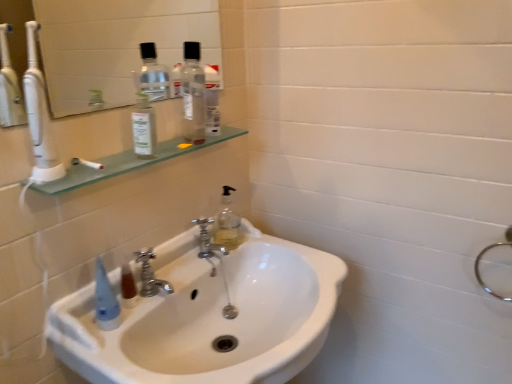
Question: From a real-world perspective, is silver metallic faucet at center, placed as the 2th tap when sorted from right to left, over white glossy sink at center?

Choices:
 (A) no
 (B) yes

Answer: (B)

Question: Can you confirm if silver metallic faucet at center, the 1th tap viewed from the front, is wider than white glossy sink at center?

Choices:
 (A) yes
 (B) no

Answer: (B)

Question: Considering the relative sizes of silver metallic faucet at center, the 1th tap viewed from the front, and white glossy sink at center in the image provided, is silver metallic faucet at center, the 1th tap viewed from the front, bigger than white glossy sink at center?

Choices:
 (A) no
 (B) yes

Answer: (A)

Question: From a real-world perspective, is silver metallic faucet at center, placed as the 2th tap when sorted from right to left, physically below white glossy sink at center?

Choices:
 (A) yes
 (B) no

Answer: (B)

Question: Can you confirm if silver metallic faucet at center, arranged as the second tap when viewed from the back, is shorter than white glossy sink at center?

Choices:
 (A) no
 (B) yes

Answer: (B)

Question: Is point (203, 137) positioned closer to the camera than point (204, 238)?

Choices:
 (A) farther
 (B) closer

Answer: (B)

Question: Is transparent plastic bottle at upper center, the second bottle viewed from the front, taller or shorter than silver metallic faucet at center, which appears as the first tap when viewed from the back?

Choices:
 (A) short
 (B) tall

Answer: (B)

Question: Is transparent plastic bottle at upper center, positioned as the second bottle in left-to-right order, spatially inside silver metallic faucet at center, which appears as the first tap when viewed from the back, or outside of it?

Choices:
 (A) outside
 (B) inside

Answer: (A)

Question: From the image's perspective, is transparent plastic bottle at upper center, the second bottle viewed from the front, located above or below silver metallic faucet at center, the second tap viewed from the left?

Choices:
 (A) below
 (B) above

Answer: (B)

Question: From a real-world perspective, relative to white glossy sink at center, is silver metallic faucet at center, the second tap viewed from the left, vertically above or below?

Choices:
 (A) above
 (B) below

Answer: (A)

Question: Is point (194, 221) closer or farther from the camera than point (181, 238)?

Choices:
 (A) closer
 (B) farther

Answer: (B)

Question: Looking at the image, does silver metallic faucet at center, which is counted as the 2th tap, starting from the front, seem bigger or smaller compared to white glossy sink at center?

Choices:
 (A) small
 (B) big

Answer: (A)

Question: Would you say silver metallic faucet at center, which is counted as the 2th tap, starting from the front, is to the left or to the right of white glossy sink at center in the picture?

Choices:
 (A) left
 (B) right

Answer: (A)

Question: From a real-world perspective, relative to transparent plastic bottle at upper center, positioned as the second bottle in left-to-right order, is clear glass mirror at upper left vertically above or below?

Choices:
 (A) above
 (B) below

Answer: (A)

Question: Is clear glass mirror at upper left to the left or to the right of transparent plastic bottle at upper center, which appears as the first bottle when viewed from the back, in the image?

Choices:
 (A) left
 (B) right

Answer: (A)